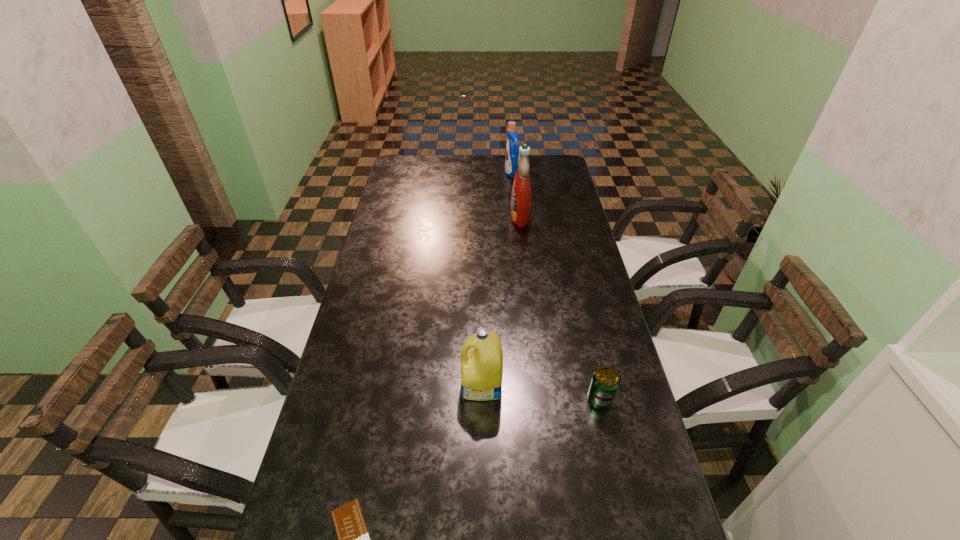
Locate which detergent is the second closest to the farthest detergent. Please provide its 2D coordinates. Your answer should be formatted as a tuple, i.e. [(x, y)], where the tuple contains the x and y coordinates of a point satisfying the conditions above.

[(482, 366)]

Where is `free space in the image that satisfies the following two spatial constraints: 1. on the front surface of the tallest object; 2. on the back side of the beer can`? This screenshot has width=960, height=540. free space in the image that satisfies the following two spatial constraints: 1. on the front surface of the tallest object; 2. on the back side of the beer can is located at coordinates (541, 400).

You are a GUI agent. You are given a task and a screenshot of the screen. Output one action in this format:
    pyautogui.click(x=<x>, y=<y>)
    Task: Click on the vacant space that satisfies the following two spatial constraints: 1. on the label of the nearest detergent; 2. on the left side of the rightmost object
    
    Given the screenshot: What is the action you would take?
    pyautogui.click(x=482, y=400)

Image resolution: width=960 pixels, height=540 pixels. What are the coordinates of `free space that satisfies the following two spatial constraints: 1. on the back side of the second shortest object; 2. on the label of the fourth object from right to left` in the screenshot? It's located at (596, 385).

Locate an element on the screen. This screenshot has height=540, width=960. blank space that satisfies the following two spatial constraints: 1. on the back side of the rightmost object; 2. on the label of the leftmost detergent is located at coordinates (596, 385).

At what (x,y) coordinates should I click in order to perform the action: click on vacant space that satisfies the following two spatial constraints: 1. on the back side of the beer can; 2. on the label of the fourth object from right to left. Please return your answer as a coordinate pair (x, y). The height and width of the screenshot is (540, 960). Looking at the image, I should click on (596, 385).